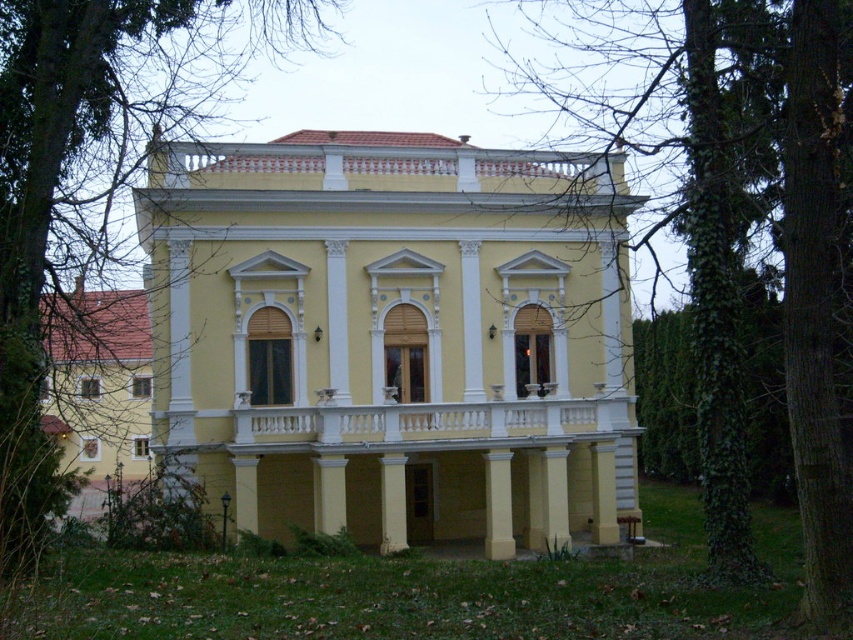
Is point (572, 356) less distant than point (83, 116)?

That is False.

Which is more to the left, yellow matte building at center or green ivy at upper left?

Positioned to the left is green ivy at upper left.

Find the location of a particular element. The image size is (853, 640). yellow matte building at center is located at coordinates (393, 337).

Can you confirm if yellow matte building at center is positioned to the right of green ivy at center?

No, yellow matte building at center is not to the right of green ivy at center.

Is point (524, 449) in front of point (764, 136)?

No.

Is point (387, 444) behind point (724, 438)?

That is True.

Where is `yellow matte building at center`? The height and width of the screenshot is (640, 853). yellow matte building at center is located at coordinates (393, 337).

Is green ivy at center below green ivy at upper left?

Yes.

Does point (816, 131) lie behind point (180, 52)?

No.

Find the location of a particular element. The height and width of the screenshot is (640, 853). green ivy at center is located at coordinates (735, 225).